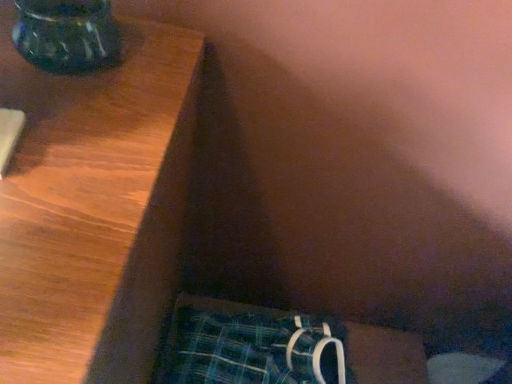
Question: Does plaid fabric underwear at lower right have a lesser width compared to translucent glass vase at upper left?

Choices:
 (A) yes
 (B) no

Answer: (B)

Question: From a real-world perspective, is plaid fabric underwear at lower right located higher than translucent glass vase at upper left?

Choices:
 (A) yes
 (B) no

Answer: (B)

Question: Considering the relative positions of plaid fabric underwear at lower right and translucent glass vase at upper left in the image provided, is plaid fabric underwear at lower right in front of translucent glass vase at upper left?

Choices:
 (A) yes
 (B) no

Answer: (B)

Question: Is plaid fabric underwear at lower right far away from translucent glass vase at upper left?

Choices:
 (A) yes
 (B) no

Answer: (B)

Question: From the image's perspective, does plaid fabric underwear at lower right appear higher than translucent glass vase at upper left?

Choices:
 (A) no
 (B) yes

Answer: (A)

Question: Could you tell me if plaid fabric underwear at lower right is facing translucent glass vase at upper left?

Choices:
 (A) yes
 (B) no

Answer: (B)

Question: Can plaid fabric underwear at lower right be found inside translucent glass vase at upper left?

Choices:
 (A) yes
 (B) no

Answer: (B)

Question: Is translucent glass vase at upper left outside of plaid fabric underwear at lower right?

Choices:
 (A) no
 (B) yes

Answer: (B)

Question: Is translucent glass vase at upper left positioned far away from plaid fabric underwear at lower right?

Choices:
 (A) no
 (B) yes

Answer: (A)

Question: Does translucent glass vase at upper left come in front of plaid fabric underwear at lower right?

Choices:
 (A) yes
 (B) no

Answer: (A)

Question: Considering the relative positions of translucent glass vase at upper left and plaid fabric underwear at lower right in the image provided, is translucent glass vase at upper left behind plaid fabric underwear at lower right?

Choices:
 (A) no
 (B) yes

Answer: (A)

Question: Considering the relative sizes of translucent glass vase at upper left and plaid fabric underwear at lower right in the image provided, is translucent glass vase at upper left bigger than plaid fabric underwear at lower right?

Choices:
 (A) no
 (B) yes

Answer: (A)

Question: From a real-world perspective, relative to plaid fabric underwear at lower right, is translucent glass vase at upper left vertically above or below?

Choices:
 (A) above
 (B) below

Answer: (A)